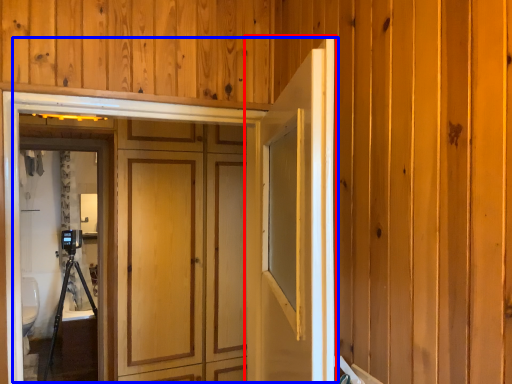
Question: Which point is closer to the camera, door (highlighted by a red box) or door (highlighted by a blue box)?

Choices:
 (A) door
 (B) door

Answer: (A)